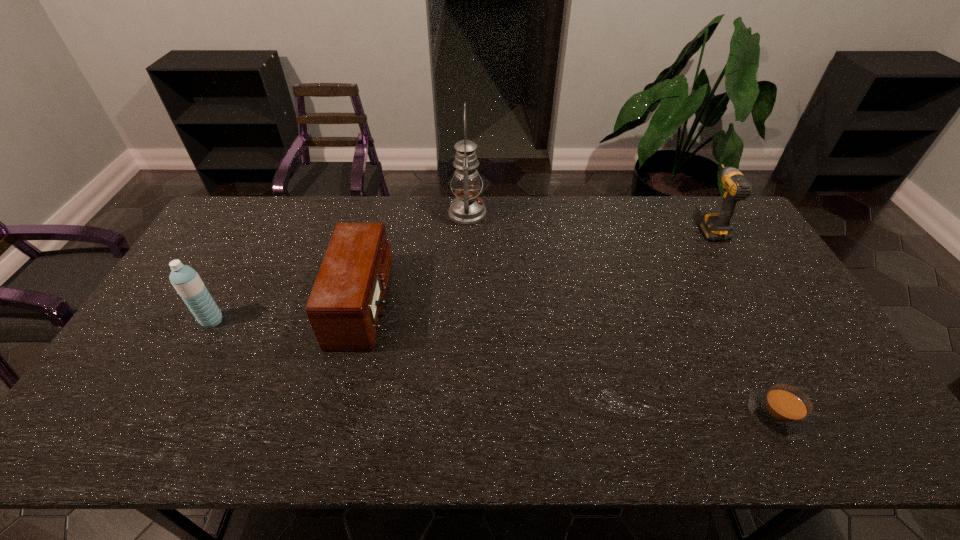
You are a GUI agent. You are given a task and a screenshot of the screen. Output one action in this format:
    pyautogui.click(x=<x>, y=<y>)
    Task: Click on the free space between the third object from right to left and the drill
    This screenshot has width=960, height=540.
    Given the screenshot: What is the action you would take?
    pyautogui.click(x=588, y=220)

Where is `vacant space that is in between the drill and the second shortest object`? The width and height of the screenshot is (960, 540). vacant space that is in between the drill and the second shortest object is located at coordinates (537, 266).

The width and height of the screenshot is (960, 540). I want to click on free point between the second shortest object and the tallest object, so click(x=416, y=259).

Find the location of a particular element. free space between the water bottle and the drill is located at coordinates (461, 274).

I want to click on empty space between the third object from right to left and the radio receiver, so click(416, 259).

Find the location of a particular element. The width and height of the screenshot is (960, 540). object that stands as the second closest to the radio receiver is located at coordinates (186, 281).

Identify which object is located as the fourth nearest to the shortest object. Please provide its 2D coordinates. Your answer should be formatted as a tuple, i.e. [(x, y)], where the tuple contains the x and y coordinates of a point satisfying the conditions above.

[(186, 281)]

The width and height of the screenshot is (960, 540). Identify the location of vacant space that satisfies the following two spatial constraints: 1. on the front side of the leftmost object; 2. on the left side of the cappuccino. (160, 415).